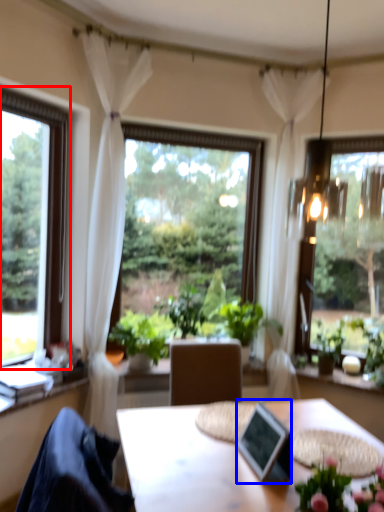
Question: Which object appears farthest to the camera in this image, window (highlighted by a red box) or picture frame (highlighted by a blue box)?

Choices:
 (A) window
 (B) picture frame

Answer: (A)